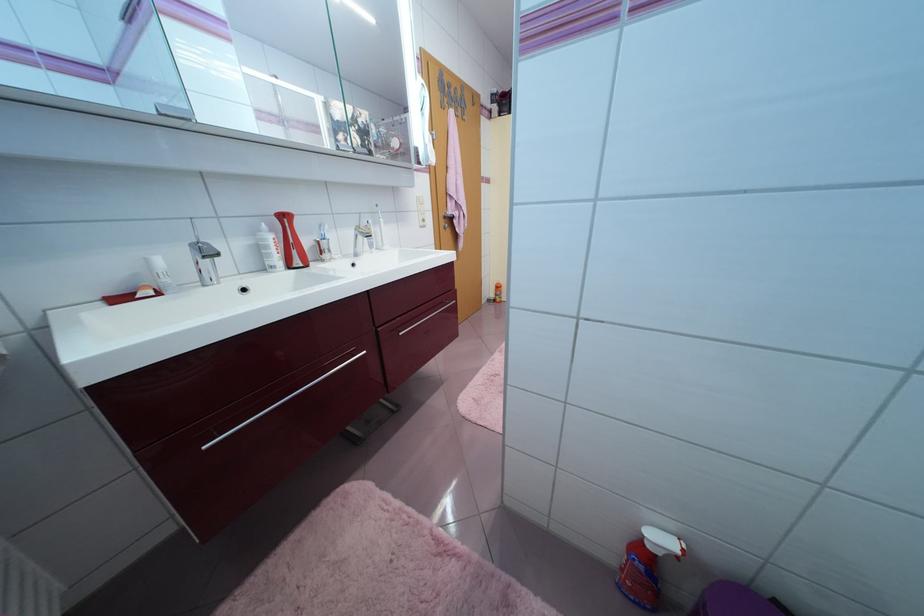
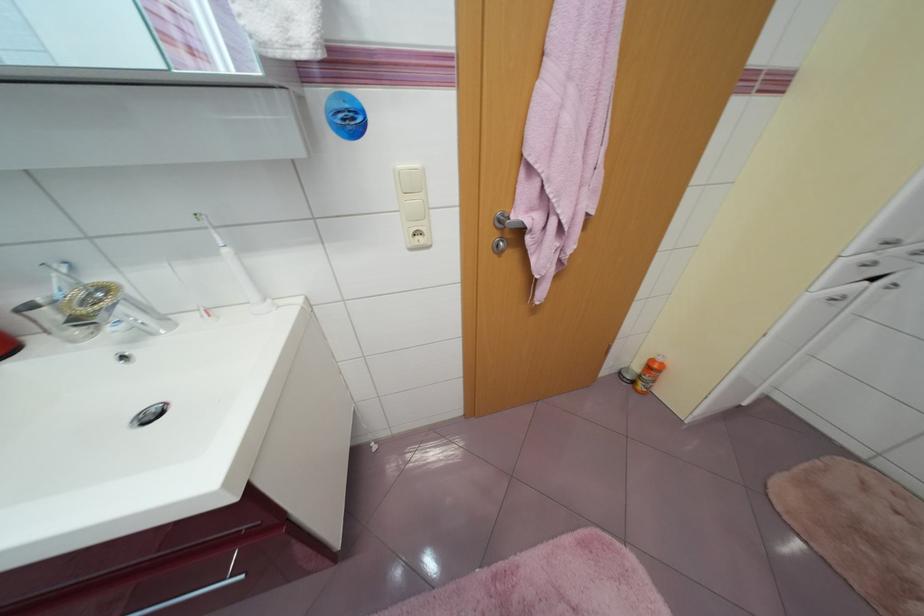
Find the pixel in the second image that matches [500,302] in the first image.

(638, 383)